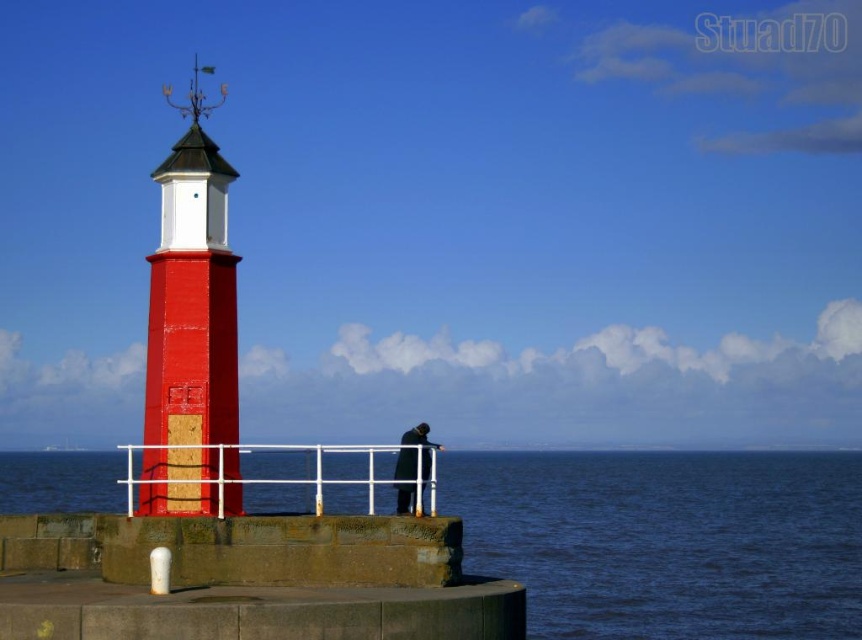
You are standing on the beach and see the smooth red lighthouse at left and the smooth concrete water at lower left. Which object is closer to you?

The smooth concrete water at lower left is closer to you because the smooth red lighthouse at left is behind it.